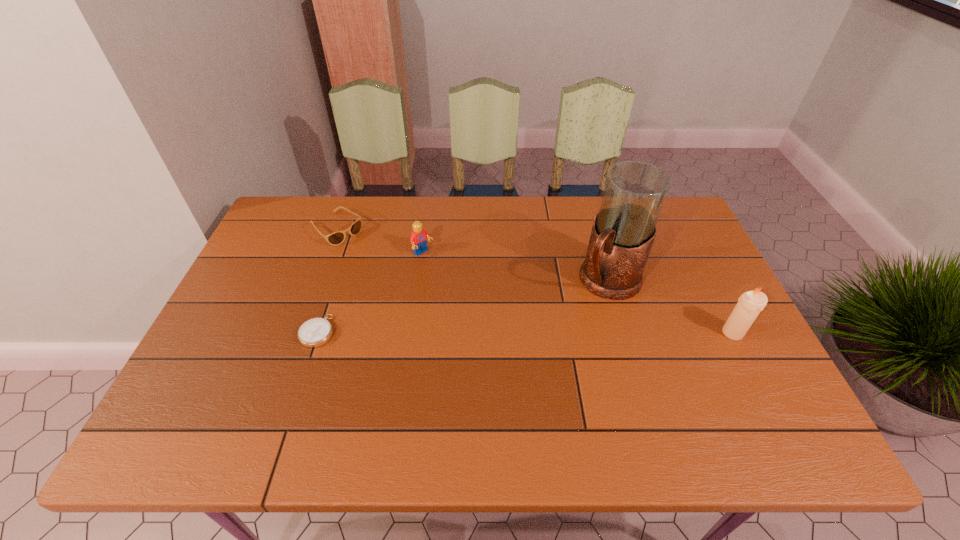
Identify the location of free space on the desktop that is between the compass and the rightmost object and is positioned with the handle on the side of the pitcher. (563, 332).

Where is `free space on the desktop that is between the shortest object and the rightmost object and is positioned on the face of the third object from left to right`? The width and height of the screenshot is (960, 540). free space on the desktop that is between the shortest object and the rightmost object and is positioned on the face of the third object from left to right is located at coordinates (517, 332).

Where is `vacant space on the desktop that is between the shortest object and the fourth shortest object and is positioned on the front-facing side of the sunglasses`? vacant space on the desktop that is between the shortest object and the fourth shortest object and is positioned on the front-facing side of the sunglasses is located at coordinates (465, 332).